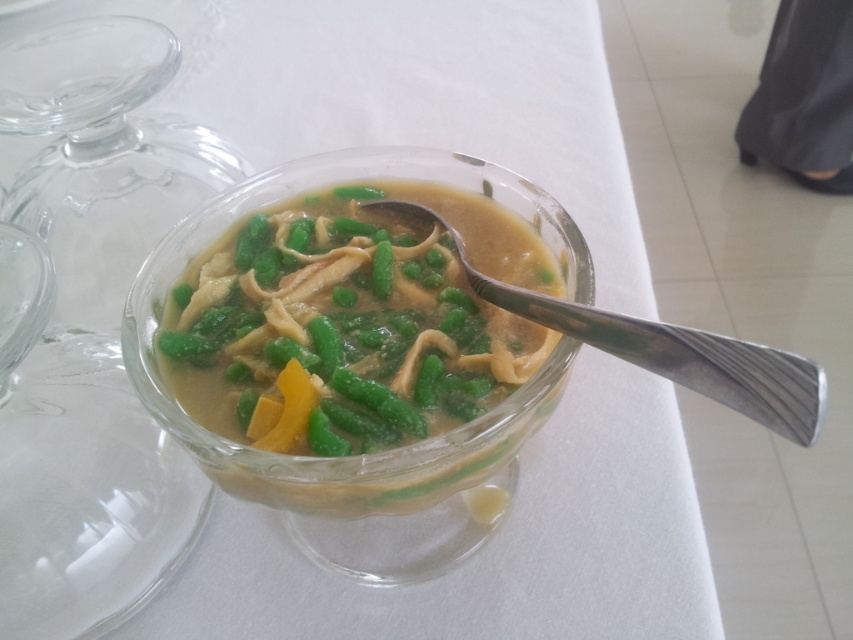
You are a food photographer setting up a shot of the translucent glass bowl at center and the silver metallic spoon at center. You want to ensure that the spoon is positioned exactly 1.5 inches away from the bowl. Based on the current setup, is the spoon too close or too far?

The current distance between the translucent glass bowl at center and the silver metallic spoon at center is 1.20 inches. Since 1.20 inches is less than 1.5 inches, the spoon is too close and needs to be moved further away to achieve the desired distance.

You are a chef trying to determine if the silver metallic spoon at center can fit inside the translucent glass bowl at center without bending. Based on the scene, can you confirm if the spoon will fit?

The translucent glass bowl at center has a larger width than the silver metallic spoon at center, so the spoon should fit inside without bending.